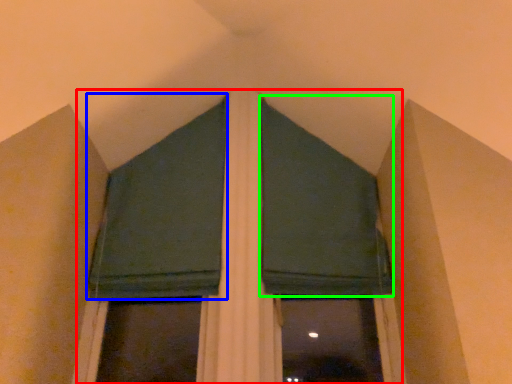
Question: Which object is the closest to the bay window (highlighted by a red box)? Choose among these: curtain (highlighted by a blue box) or curtain (highlighted by a green box).

Choices:
 (A) curtain
 (B) curtain

Answer: (B)